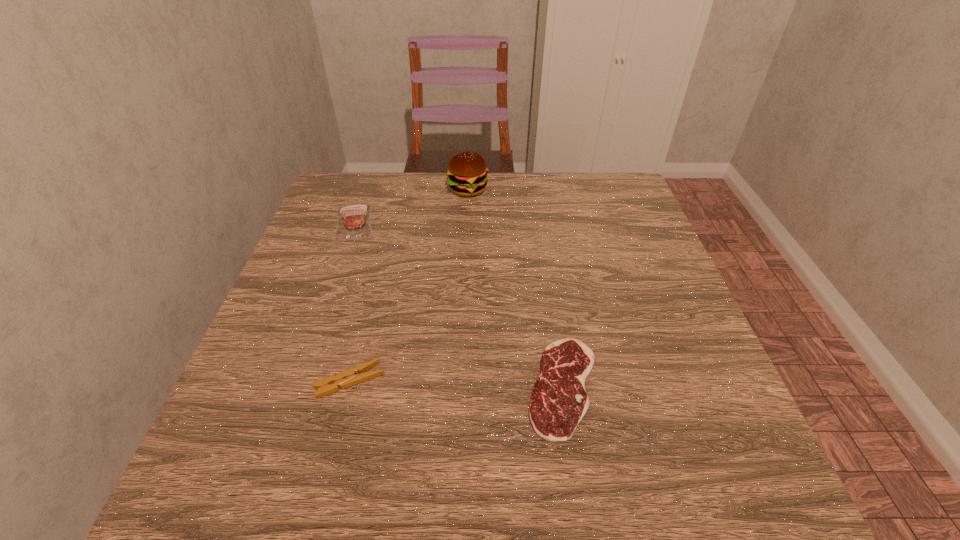
Identify the location of vacant space located 0.220m on the right of the rightmost object. (726, 387).

Where is `hamburger situated at the far edge`? Image resolution: width=960 pixels, height=540 pixels. hamburger situated at the far edge is located at coordinates click(x=467, y=172).

Where is `steak at the far edge`? This screenshot has height=540, width=960. steak at the far edge is located at coordinates (354, 221).

The image size is (960, 540). Find the location of `steak positioned at the left edge`. steak positioned at the left edge is located at coordinates (354, 221).

The image size is (960, 540). I want to click on clothespin that is at the left edge, so click(x=357, y=374).

This screenshot has height=540, width=960. In order to click on object present at the far left corner in this screenshot , I will do click(354, 221).

The width and height of the screenshot is (960, 540). In the image, there is a desktop. Find the location of `free space at the far edge`. free space at the far edge is located at coordinates (529, 210).

This screenshot has height=540, width=960. In the image, there is a desktop. What are the coordinates of `vacant space at the near edge` in the screenshot? It's located at (427, 455).

Image resolution: width=960 pixels, height=540 pixels. Find the location of `vacant region at the left edge of the desktop`. vacant region at the left edge of the desktop is located at coordinates (329, 239).

This screenshot has height=540, width=960. In the image, there is a desktop. Identify the location of vacant space at the right edge. (636, 260).